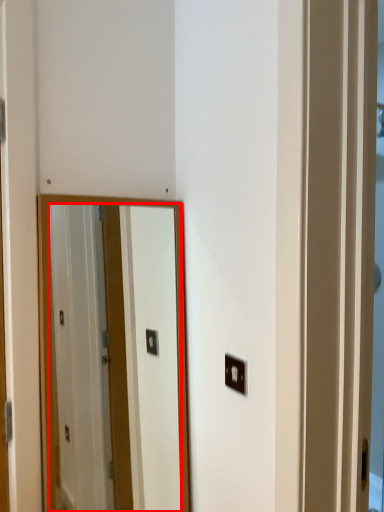
Question: From the image's perspective, what is the correct spatial positioning of mirror (annotated by the red box) in reference to light switch?

Choices:
 (A) below
 (B) above

Answer: (A)